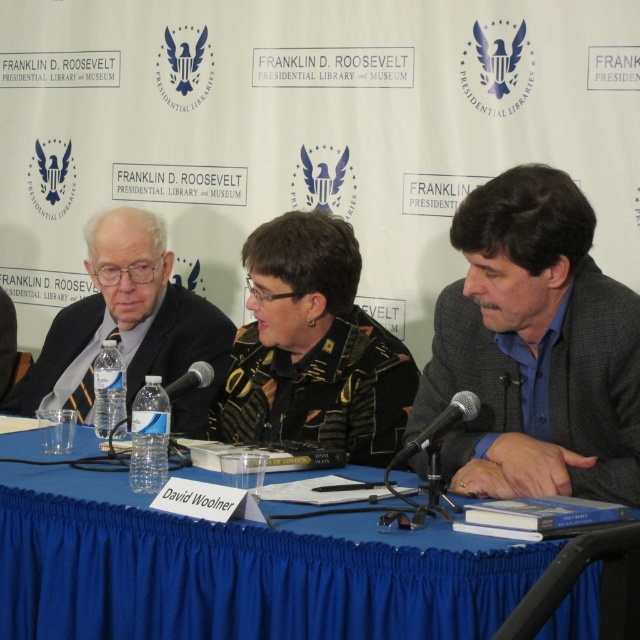
Question: Does blue fabric table at center lie in front of clear plastic water bottle at left?

Choices:
 (A) yes
 (B) no

Answer: (A)

Question: Considering the real-world distances, which object is farthest from the black textured jacket at center?

Choices:
 (A) matte black suit at left
 (B) clear plastic water bottle at left
 (C) gray woolen suit at right
 (D) black metallic microphone at right

Answer: (B)

Question: Is the position of clear plastic water bottle at left less distant than that of black plastic microphone at center?

Choices:
 (A) yes
 (B) no

Answer: (B)

Question: Based on their relative distances, which object is nearer to the black textured jacket at center?

Choices:
 (A) clear plastic water bottle at left
 (B) gray woolen suit at right
 (C) black plastic microphone at center
 (D) matte black suit at left

Answer: (C)

Question: Which object is farther from the camera taking this photo?

Choices:
 (A) gray woolen suit at right
 (B) matte black suit at left
 (C) black plastic microphone at center

Answer: (B)

Question: Where is blue fabric table at center located in relation to matte black suit at left in the image?

Choices:
 (A) right
 (B) left

Answer: (A)